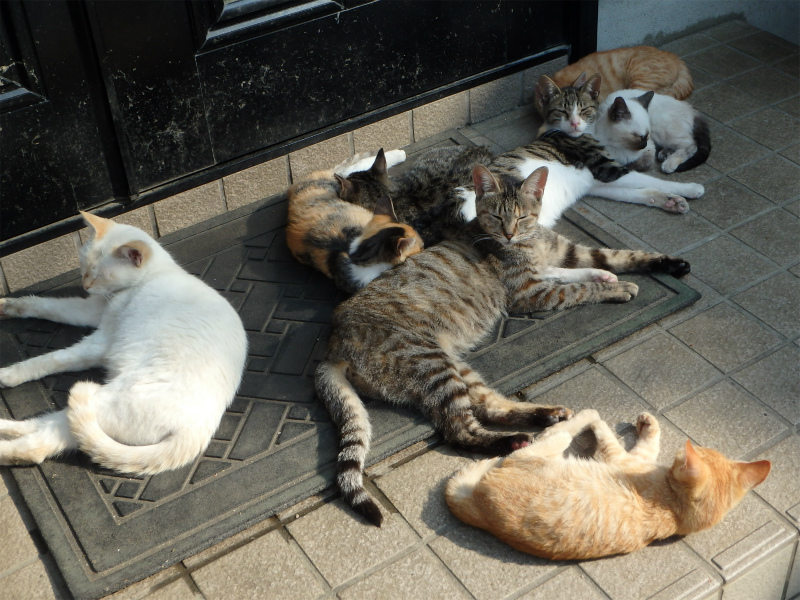
Locate an element on the screen. floor surface is located at coordinates (665, 370).